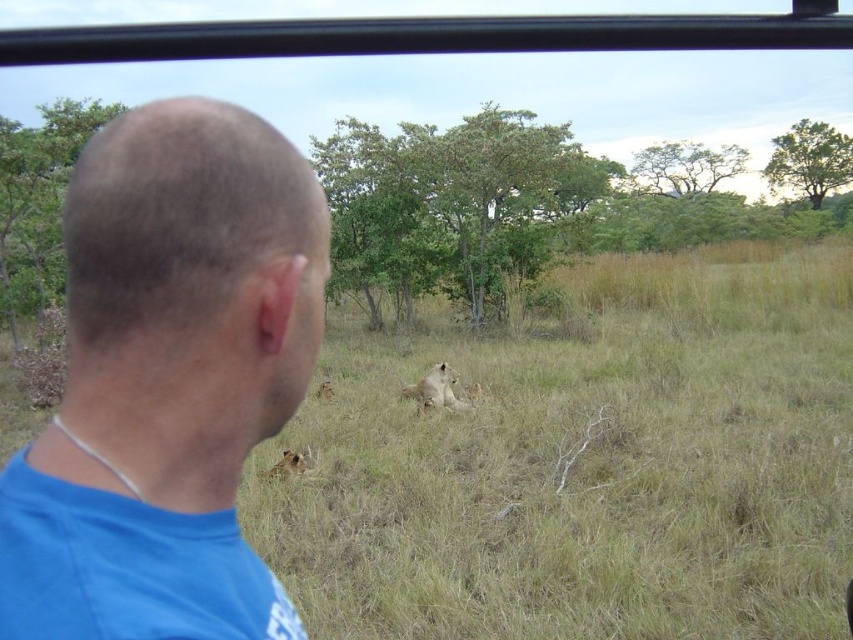
Question: Which of the following is the farthest from the observer?

Choices:
 (A) (305, 369)
 (B) (289, 468)
 (C) (679, 272)
 (D) (456, 376)

Answer: (C)

Question: Is blue fabric shirt at left above golden fur lion at lower left?

Choices:
 (A) yes
 (B) no

Answer: (A)

Question: In this image, where is blue fabric shirt at left located relative to golden fur lion at lower left?

Choices:
 (A) below
 (B) above

Answer: (B)

Question: Does green grassy at center have a lesser width compared to blue fabric shirt at left?

Choices:
 (A) yes
 (B) no

Answer: (B)

Question: Among these objects, which one is nearest to the camera?

Choices:
 (A) golden fur lion at lower left
 (B) green grassy at center
 (C) golden fur lion at center
 (D) blue fabric shirt at left

Answer: (D)

Question: Which point appears farthest from the camera in this image?

Choices:
 (A) (271, 470)
 (B) (424, 396)
 (C) (828, 584)
 (D) (231, 340)

Answer: (B)